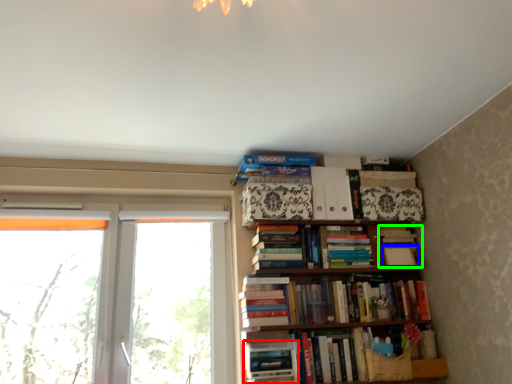
Question: Which is farther away from book (highlighted by a red box)? paperback book (highlighted by a blue box) or book (highlighted by a green box)?

Choices:
 (A) paperback book
 (B) book

Answer: (A)